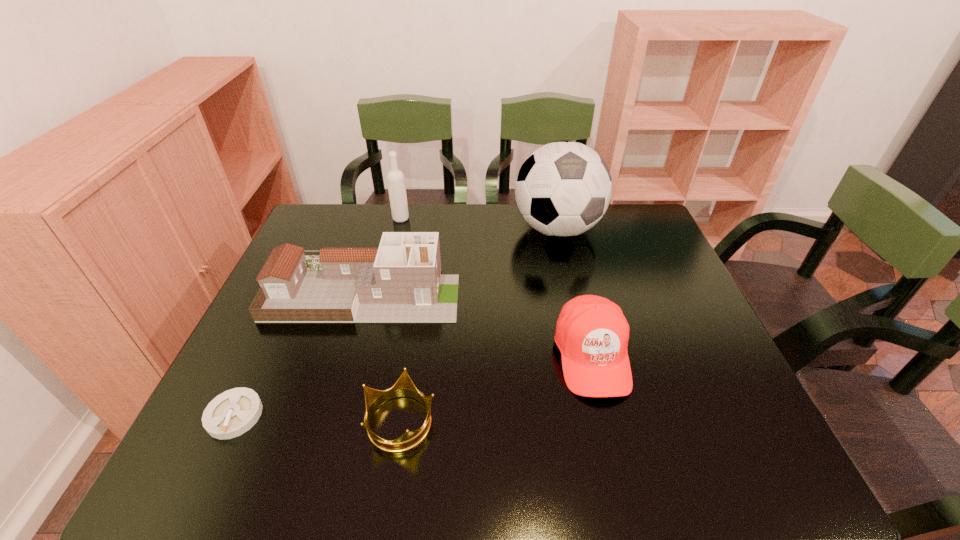
Find the location of a particular element. vacant area that lies between the crown and the fourth shortest object is located at coordinates (382, 357).

Where is `free spot between the fifth shortest object and the tallest object`? The height and width of the screenshot is (540, 960). free spot between the fifth shortest object and the tallest object is located at coordinates (479, 224).

The image size is (960, 540). What are the coordinates of `unoccupied position between the fourth shortest object and the ashtray` in the screenshot? It's located at (299, 355).

I want to click on the fourth closest object relative to the shortest object, so click(x=395, y=178).

Find the location of a particular element. object that stands as the fifth closest to the dollhouse is located at coordinates (592, 334).

At what (x,y) coordinates should I click in order to perform the action: click on vacant space that satisfies the following two spatial constraints: 1. on the main logo of the tallest object; 2. at the main entrance of the fourth shortest object. Please return your answer as a coordinate pair (x, y). This screenshot has width=960, height=540. Looking at the image, I should click on (572, 294).

The image size is (960, 540). Identify the location of vacant point that satisfies the following two spatial constraints: 1. on the main logo of the soccer ball; 2. at the main entrance of the dollhouse. (572, 294).